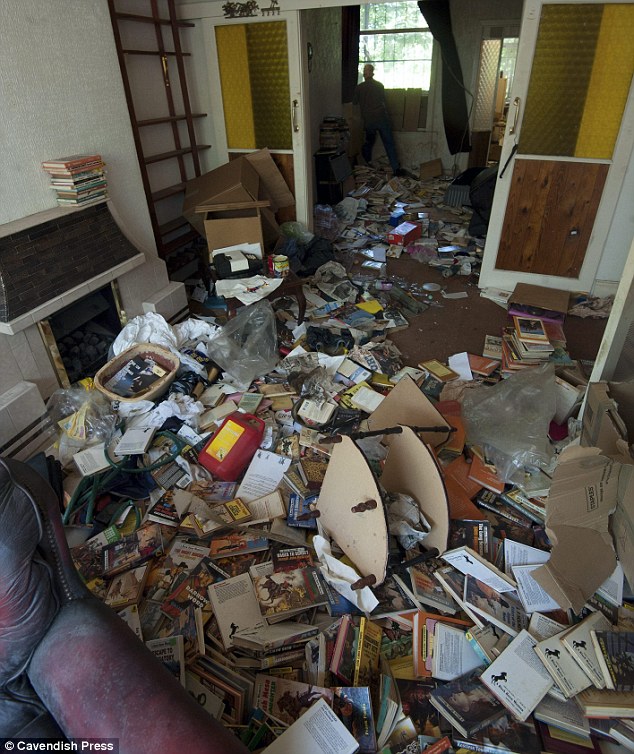
The image size is (634, 754). Find the location of `boxes`. boxes is located at coordinates (246, 222).